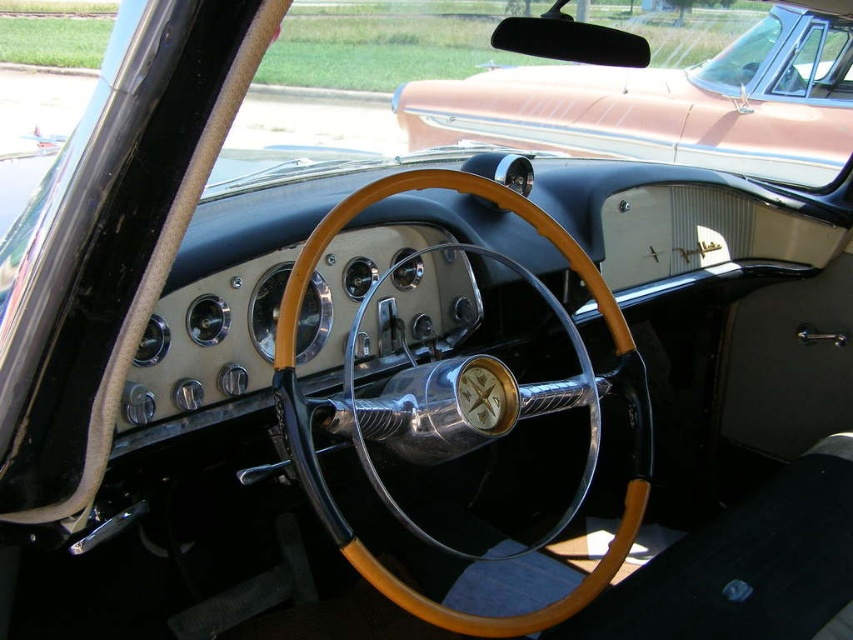
Which is in front, point (393, 593) or point (840, 67)?

Point (393, 593)

At what (x,y) coordinates should I click in order to perform the action: click on wooden/leather steering wheel at center. Please return your answer as a coordinate pair (x, y). Looking at the image, I should click on (445, 188).

Which is in front, point (346, 560) or point (776, 42)?

Point (346, 560) is in front.

Identify the location of wooden/leather steering wheel at center. Image resolution: width=853 pixels, height=640 pixels. (445, 188).

Who is shorter, matte orange car at upper center or wooden/leather steering wheel at center?

wooden/leather steering wheel at center is shorter.

Who is positioned more to the right, matte orange car at upper center or wooden/leather steering wheel at center?

From the viewer's perspective, matte orange car at upper center appears more on the right side.

What do you see at coordinates (666, 104) in the screenshot? This screenshot has height=640, width=853. I see `matte orange car at upper center` at bounding box center [666, 104].

Where is `matte orange car at upper center`? The height and width of the screenshot is (640, 853). matte orange car at upper center is located at coordinates (666, 104).

Is matte orange car at upper center further to the viewer compared to clear glass windshield at upper center?

That is False.

You are a GUI agent. You are given a task and a screenshot of the screen. Output one action in this format:
    pyautogui.click(x=<x>, y=<y>)
    Task: Click on the matte orange car at upper center
    The width and height of the screenshot is (853, 640).
    Given the screenshot: What is the action you would take?
    pos(666,104)

Locate an element on the screen. The image size is (853, 640). matte orange car at upper center is located at coordinates (666, 104).